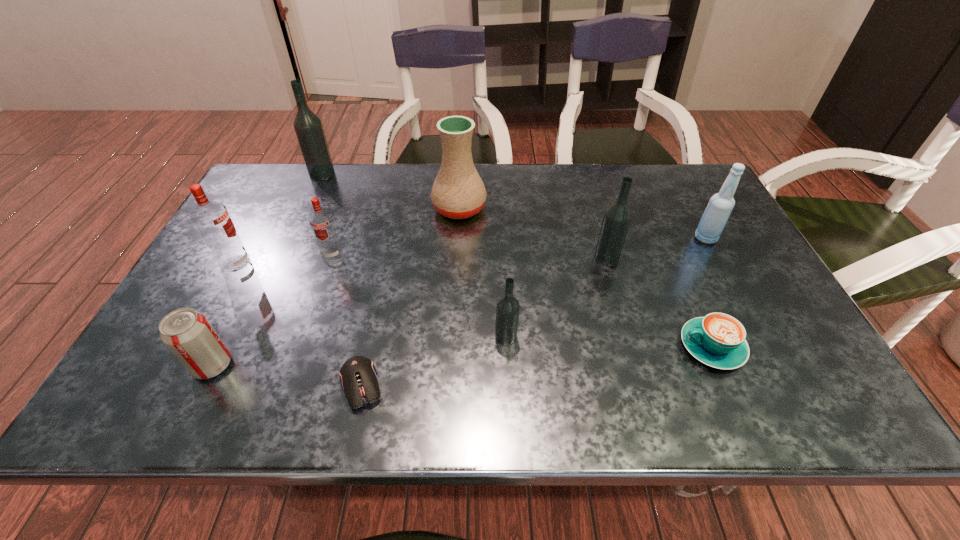
Find the location of `vacant region located on the front of the tallest vodka`. vacant region located on the front of the tallest vodka is located at coordinates (287, 254).

Locate an element on the screen. The width and height of the screenshot is (960, 540). vacant space situated 0.350m on the left of the pottery is located at coordinates (314, 208).

Image resolution: width=960 pixels, height=540 pixels. I want to click on free space located on the right of the second farthest black vodka, so click(687, 257).

The width and height of the screenshot is (960, 540). What are the coordinates of `vacant area situated 0.270m on the front label of the leftmost vodka` in the screenshot? It's located at (354, 264).

Where is `vacant space located on the back of the bottle`? The height and width of the screenshot is (540, 960). vacant space located on the back of the bottle is located at coordinates (686, 203).

At what (x,y) coordinates should I click in order to perform the action: click on vacant space located 0.320m on the left of the nearest black vodka. Please return your answer as a coordinate pair (x, y). Image resolution: width=960 pixels, height=540 pixels. Looking at the image, I should click on (351, 336).

Find the location of a particular element. vacant space located 0.400m on the front label of the right red vodka is located at coordinates (281, 402).

This screenshot has height=540, width=960. In order to click on blank space located on the left of the gray soda can in this screenshot , I will do `click(160, 365)`.

In order to click on free space located 0.400m with the handle on the right side of the second shortest object in this screenshot , I will do `click(497, 347)`.

This screenshot has height=540, width=960. I want to click on free region located with the handle on the right side of the second shortest object, so click(x=566, y=347).